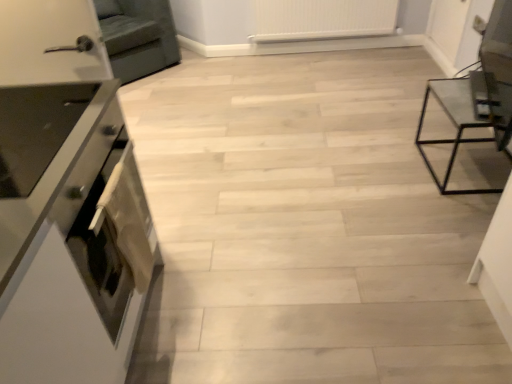
Question: From the image's perspective, would you say transparent glass table at right is positioned over white plastic radiator at upper center?

Choices:
 (A) no
 (B) yes

Answer: (A)

Question: Does transparent glass table at right have a greater height compared to white plastic radiator at upper center?

Choices:
 (A) yes
 (B) no

Answer: (A)

Question: Does transparent glass table at right come behind white plastic radiator at upper center?

Choices:
 (A) no
 (B) yes

Answer: (A)

Question: Is white plastic radiator at upper center a part of transparent glass table at right?

Choices:
 (A) no
 (B) yes

Answer: (A)

Question: Is the depth of transparent glass table at right less than that of white plastic radiator at upper center?

Choices:
 (A) no
 (B) yes

Answer: (B)

Question: In the image, is transparent glass table at right on the left side or the right side of satin silver oven at left?

Choices:
 (A) left
 (B) right

Answer: (B)

Question: Do you think transparent glass table at right is within satin silver oven at left, or outside of it?

Choices:
 (A) outside
 (B) inside

Answer: (A)

Question: Is transparent glass table at right in front of or behind satin silver oven at left in the image?

Choices:
 (A) front
 (B) behind

Answer: (B)

Question: Considering the positions of point click(x=492, y=190) and point click(x=118, y=299), is point click(x=492, y=190) closer or farther from the camera than point click(x=118, y=299)?

Choices:
 (A) farther
 (B) closer

Answer: (A)

Question: From their relative heights in the image, would you say white plastic radiator at upper center is taller or shorter than dark gray fabric armchair at upper left?

Choices:
 (A) tall
 (B) short

Answer: (B)

Question: From the image's perspective, is white plastic radiator at upper center positioned above or below dark gray fabric armchair at upper left?

Choices:
 (A) above
 (B) below

Answer: (A)

Question: Is white plastic radiator at upper center wider or thinner than dark gray fabric armchair at upper left?

Choices:
 (A) wide
 (B) thin

Answer: (B)

Question: Does point (369, 31) appear closer or farther from the camera than point (172, 28)?

Choices:
 (A) farther
 (B) closer

Answer: (A)

Question: In terms of width, does dark gray fabric armchair at upper left look wider or thinner when compared to transparent glass table at right?

Choices:
 (A) thin
 (B) wide

Answer: (B)

Question: In terms of height, does dark gray fabric armchair at upper left look taller or shorter compared to transparent glass table at right?

Choices:
 (A) short
 (B) tall

Answer: (B)